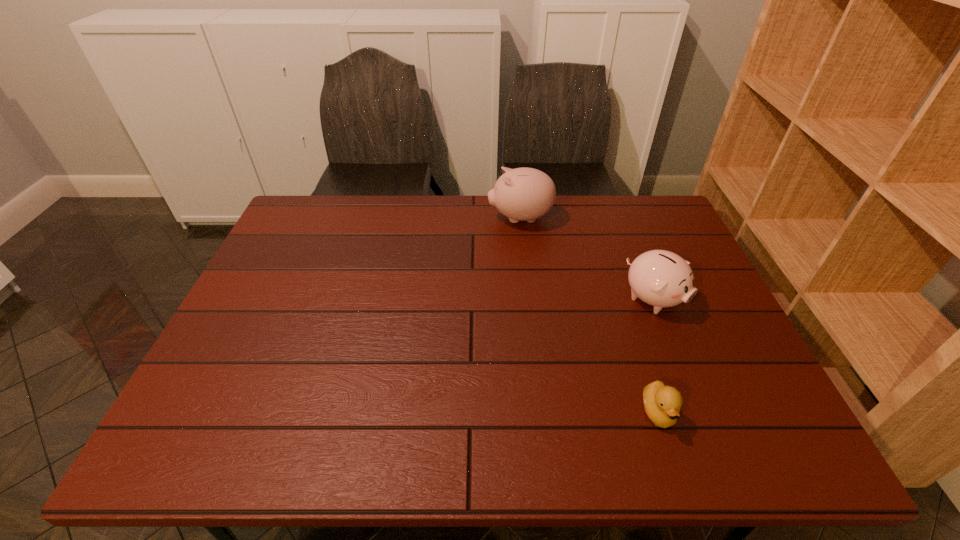
At what (x,y) coordinates should I click in order to perform the action: click on the farthest object. Please return your answer as a coordinate pair (x, y). The image size is (960, 540). Looking at the image, I should click on (522, 194).

Where is `the farther piggy bank`? the farther piggy bank is located at coordinates (522, 194).

The width and height of the screenshot is (960, 540). What are the coordinates of `the second shortest object` in the screenshot? It's located at (660, 278).

Where is `the nearer piggy bank`? This screenshot has height=540, width=960. the nearer piggy bank is located at coordinates (660, 278).

Identify the location of duckling. (662, 404).

This screenshot has height=540, width=960. Identify the location of the nearest object. (662, 404).

This screenshot has width=960, height=540. In order to click on vacant area situated at the snout of the farther piggy bank in this screenshot , I will do 436,218.

Identify the location of free space located 0.340m at the snout of the farther piggy bank. Image resolution: width=960 pixels, height=540 pixels. 384,218.

The image size is (960, 540). I want to click on free point located 0.200m at the snout of the farther piggy bank, so click(x=427, y=218).

Identify the location of free space located 0.070m on the front of the shorter piggy bank. The height and width of the screenshot is (540, 960). (671, 344).